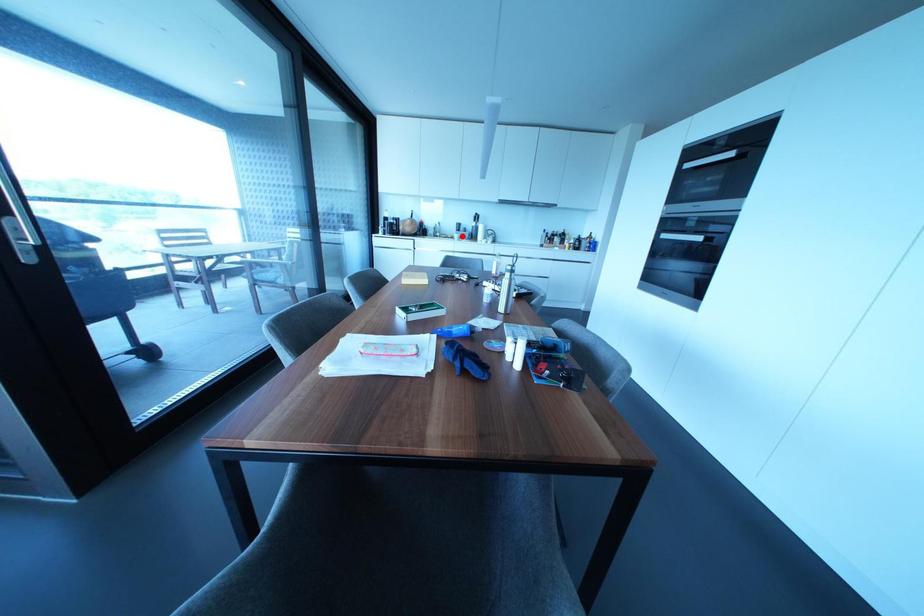
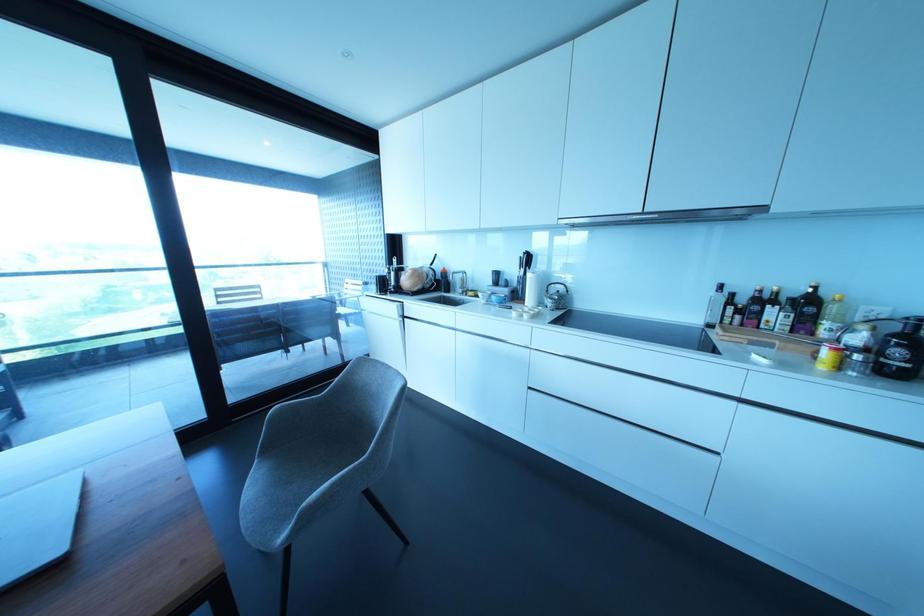
In the second image, find the point that corresponds to the highlighted location in the first image.

(492, 297)